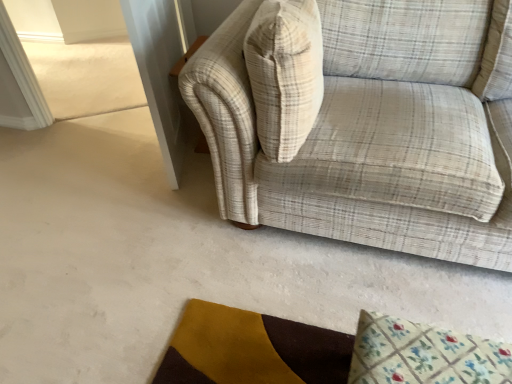
Question: From a real-world perspective, is plaid fabric couch at upper right physically located above or below floral fabric mat at lower right?

Choices:
 (A) above
 (B) below

Answer: (A)

Question: Is plaid fabric couch at upper right taller or shorter than floral fabric mat at lower right?

Choices:
 (A) tall
 (B) short

Answer: (A)

Question: Which object is the farthest from the plaid fabric couch at upper right?

Choices:
 (A) beige plaid throw pillow at upper right
 (B) floral fabric mat at lower right

Answer: (B)

Question: Estimate the real-world distances between objects in this image. Which object is farther from the plaid fabric couch at upper right?

Choices:
 (A) beige plaid throw pillow at upper right
 (B) floral fabric mat at lower right

Answer: (B)